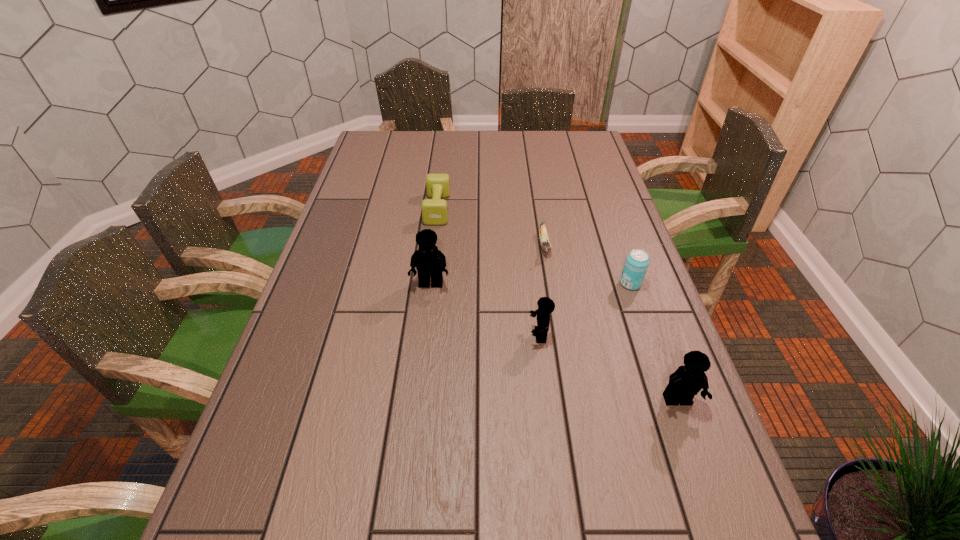
Locate an element on the screen. vacant space at the near edge of the desktop is located at coordinates pos(354,464).

Identify the location of vacant space at the left edge. This screenshot has width=960, height=540. (367, 274).

You are a GUI agent. You are given a task and a screenshot of the screen. Output one action in this format:
    pyautogui.click(x=<x>, y=<y>)
    Task: Click on the free region at the right edge of the desktop
    The width and height of the screenshot is (960, 540).
    Given the screenshot: What is the action you would take?
    pyautogui.click(x=584, y=237)

I want to click on free space at the far left corner of the desktop, so click(382, 133).

Where is `vacant point located between the second nearest object and the nearest Lego`? vacant point located between the second nearest object and the nearest Lego is located at coordinates (609, 368).

Locate an element on the screen. The height and width of the screenshot is (540, 960). free spot between the nearest object and the dumbbell is located at coordinates (557, 305).

The width and height of the screenshot is (960, 540). I want to click on unoccupied position between the second shortest Lego and the fourth tallest object, so click(x=654, y=342).

The width and height of the screenshot is (960, 540). In order to click on free space between the shortest Lego and the farthest object in this screenshot , I will do `click(489, 272)`.

You are a GUI agent. You are given a task and a screenshot of the screen. Output one action in this format:
    pyautogui.click(x=<x>, y=<y>)
    Task: Click on the vacant space in between the farthest object and the nearest object
    The width and height of the screenshot is (960, 540).
    Given the screenshot: What is the action you would take?
    pyautogui.click(x=557, y=305)

Where is `vacant area between the leftmost Lego and the third shortest object`? vacant area between the leftmost Lego and the third shortest object is located at coordinates (531, 284).